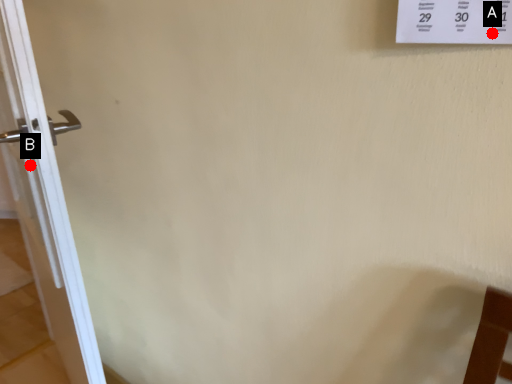
Question: Two points are circled on the image, labeled by A and B beside each circle. Which point is closer to the camera?

Choices:
 (A) A is closer
 (B) B is closer

Answer: (A)